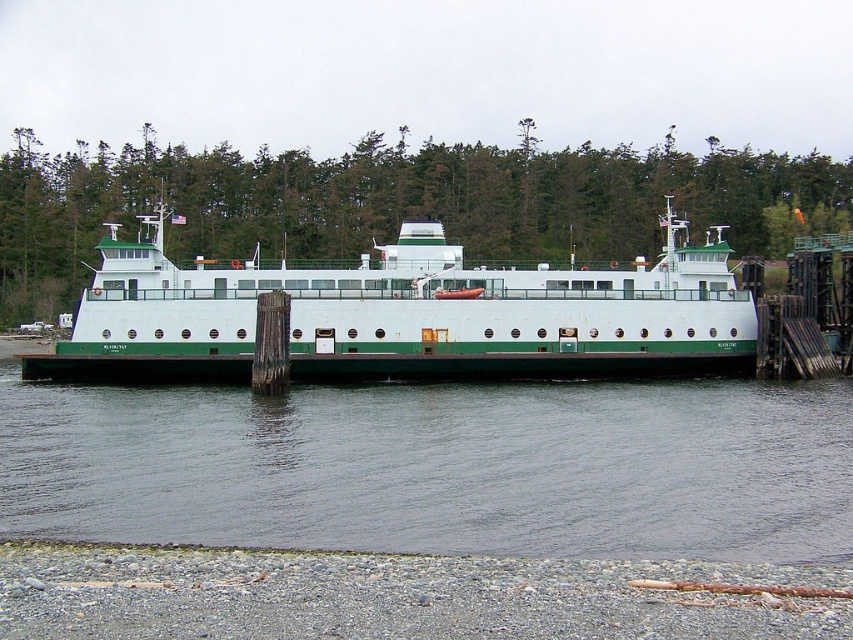
Does white matte ferry at center have a greater height compared to gray gravel shoreline at lower left?

Yes, white matte ferry at center is taller than gray gravel shoreline at lower left.

Does white matte ferry at center have a smaller size compared to gray gravel shoreline at lower left?

No.

This screenshot has height=640, width=853. Describe the element at coordinates (407, 314) in the screenshot. I see `white matte ferry at center` at that location.

Find the location of `white matte ferry at center`. white matte ferry at center is located at coordinates (407, 314).

The height and width of the screenshot is (640, 853). Describe the element at coordinates (439, 467) in the screenshot. I see `green water at center` at that location.

Between point (750, 541) and point (660, 336), which one is positioned behind?

Point (660, 336)

Find the location of a particular element. Image resolution: width=853 pixels, height=640 pixels. green water at center is located at coordinates (439, 467).

This screenshot has width=853, height=640. I want to click on green water at center, so click(x=439, y=467).

Is green water at center wider than gray gravel shoreline at lower left?

Yes.

Measure the distance between point (254,532) and camera.

53.26 feet

Locate an element on the screen. green water at center is located at coordinates (439, 467).